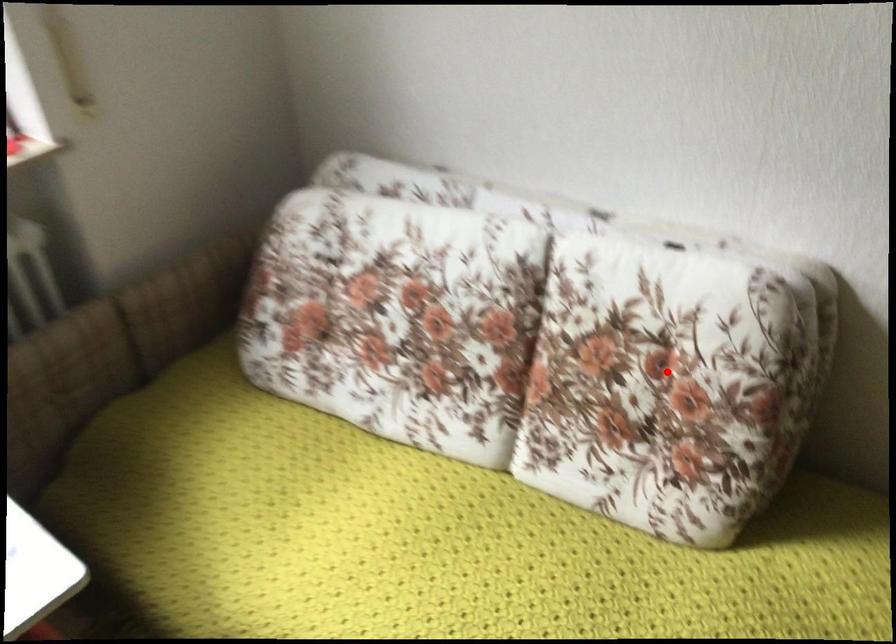
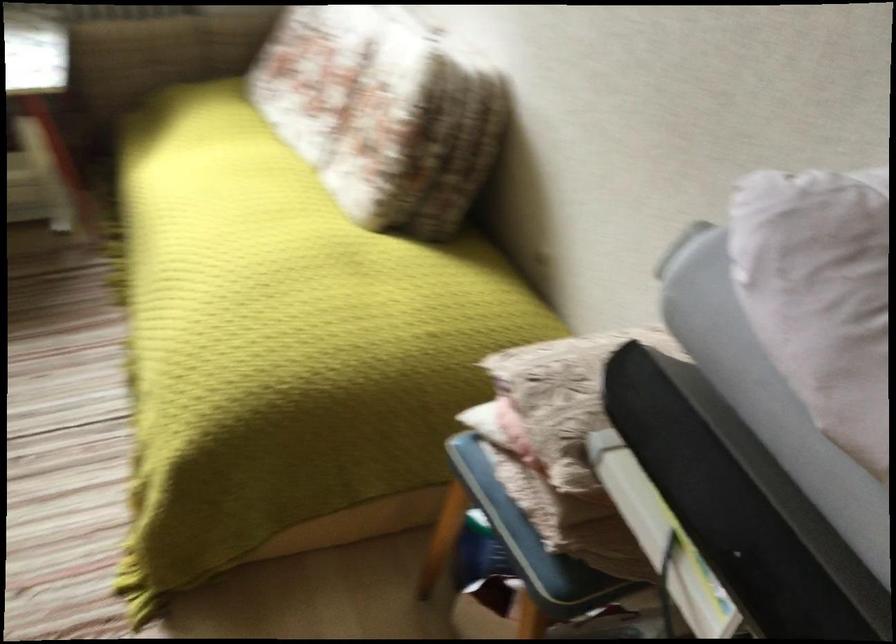
In the second image, find the point that corresponds to the highlighted location in the first image.

(382, 114)